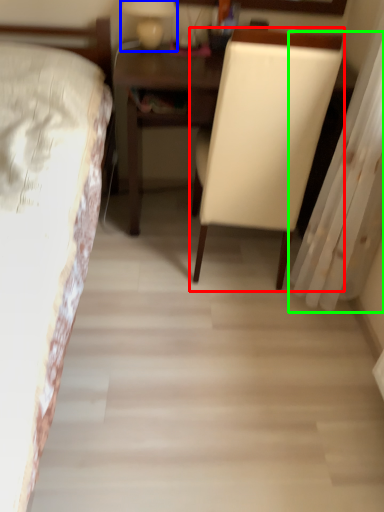
Question: Which is farther away from chair (highlighted by a red box)? bedside lamp (highlighted by a blue box) or curtain (highlighted by a green box)?

Choices:
 (A) bedside lamp
 (B) curtain

Answer: (A)